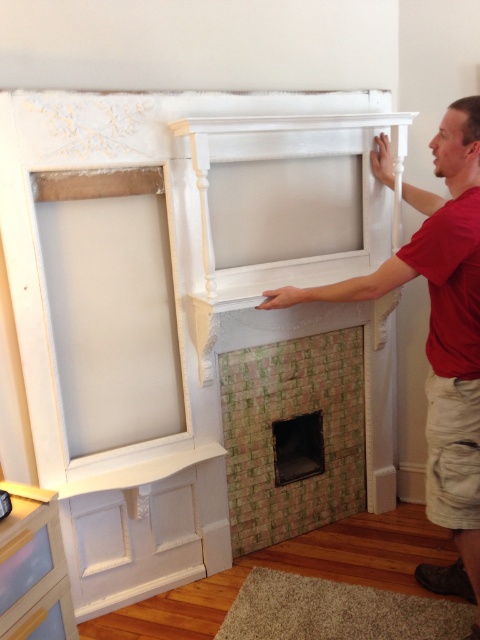
Is matte white fireplace at right to the left of green mosaic tile fireplace at center from the viewer's perspective?

In fact, matte white fireplace at right is to the right of green mosaic tile fireplace at center.

You are a GUI agent. You are given a task and a screenshot of the screen. Output one action in this format:
    pyautogui.click(x=<x>, y=<y>)
    Task: Click on the matte white fireplace at right
    Image resolution: width=480 pixels, height=640 pixels.
    Given the screenshot: What is the action you would take?
    pyautogui.click(x=440, y=339)

I want to click on matte white fireplace at right, so click(440, 339).

This screenshot has height=640, width=480. I want to click on matte white fireplace at right, so click(440, 339).

Is white painted wood window frame at upper left to the left of matte white fireplace at right from the viewer's perspective?

Correct, you'll find white painted wood window frame at upper left to the left of matte white fireplace at right.

Who is taller, white painted wood window frame at upper left or matte white fireplace at right?

With more height is matte white fireplace at right.

Between point (93, 381) and point (464, 500), which one is positioned in front?

Positioned in front is point (464, 500).

This screenshot has height=640, width=480. Find the location of `white painted wood window frame at upper left`. white painted wood window frame at upper left is located at coordinates (110, 305).

Who is taller, white painted wood window frame at upper left or green mosaic tile fireplace at center?

Standing taller between the two is white painted wood window frame at upper left.

Is point (63, 340) positioned before point (358, 492)?

Yes, it is.

You are a GUI agent. You are given a task and a screenshot of the screen. Output one action in this format:
    pyautogui.click(x=<x>, y=<y>)
    Task: Click on the white painted wood window frame at upper left
    Image resolution: width=480 pixels, height=640 pixels.
    Given the screenshot: What is the action you would take?
    pyautogui.click(x=110, y=305)